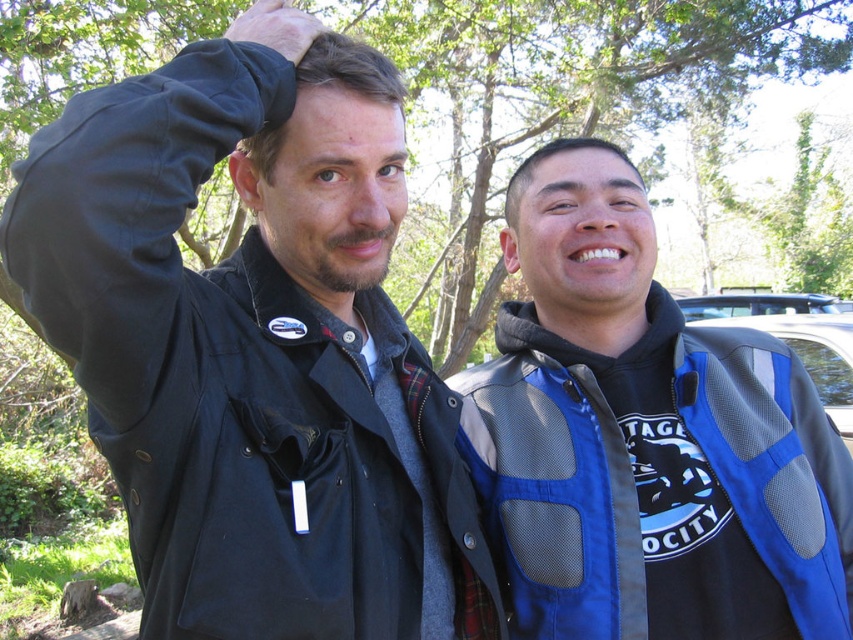
Question: Is the position of matte black jacket at left more distant than that of blue mesh jacket at right?

Choices:
 (A) no
 (B) yes

Answer: (A)

Question: Considering the relative positions of matte black jacket at left and blue mesh jacket at right in the image provided, where is matte black jacket at left located with respect to blue mesh jacket at right?

Choices:
 (A) right
 (B) left

Answer: (B)

Question: Does matte black jacket at left appear over blue mesh jacket at right?

Choices:
 (A) yes
 (B) no

Answer: (A)

Question: Which of the following is the farthest from the observer?

Choices:
 (A) pyautogui.click(x=525, y=572)
 (B) pyautogui.click(x=355, y=612)

Answer: (A)

Question: Which point is farther from the camera taking this photo?

Choices:
 (A) 606,572
 (B) 297,182

Answer: (A)